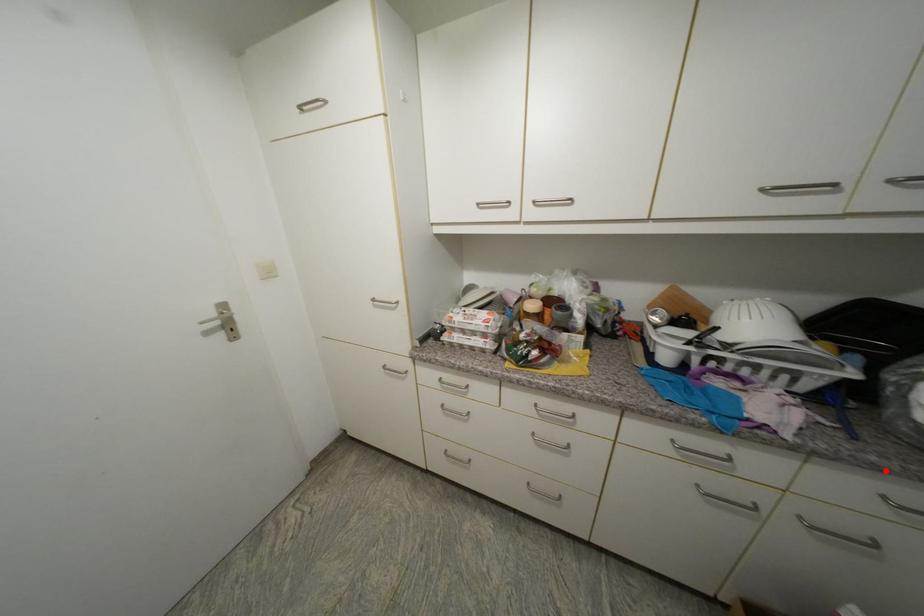
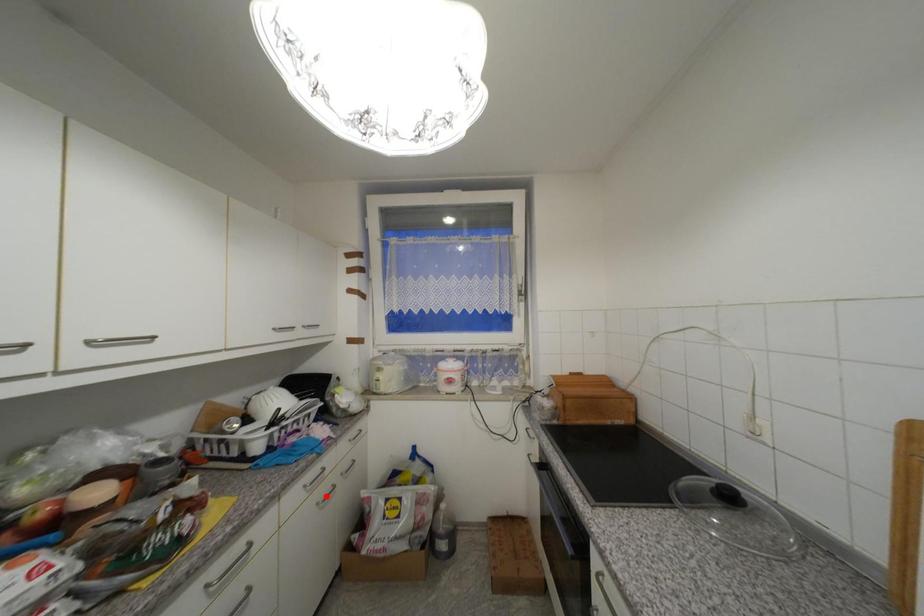
I am providing you with two images of the same scene from different viewpoints. A red point is marked on the first image and another point is marked on the second image. Are the points marked in image1 and image2 representing the same 3D position?

No